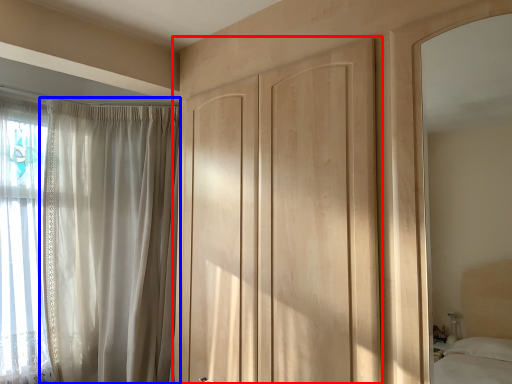
Question: Among these objects, which one is farthest to the camera, door (highlighted by a red box) or curtain (highlighted by a blue box)?

Choices:
 (A) door
 (B) curtain

Answer: (B)